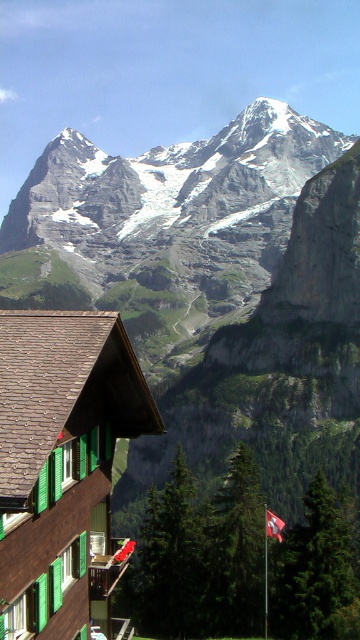
Between brown shingle chalet at lower left and red fabric flag at lower right, which one has less height?

With less height is red fabric flag at lower right.

Who is positioned more to the left, brown shingle chalet at lower left or red fabric flag at lower right?

brown shingle chalet at lower left is more to the left.

In the scene shown: Who is more forward, (x=51, y=360) or (x=279, y=536)?

Point (x=51, y=360) is more forward.

Find the location of a particular element. This screenshot has height=640, width=360. brown shingle chalet at lower left is located at coordinates (62, 467).

Is snowy granite mountain range at upper center positioned before red fabric flag at lower right?

No, it is behind red fabric flag at lower right.

Based on the photo, who is positioned more to the right, snowy granite mountain range at upper center or red fabric flag at lower right?

red fabric flag at lower right is more to the right.

Is point (270, 198) more distant than point (271, 518)?

Yes, point (270, 198) is farther from viewer.

The height and width of the screenshot is (640, 360). Find the location of `snowy granite mountain range at upper center`. snowy granite mountain range at upper center is located at coordinates (173, 196).

Who is positioned more to the right, brown shingle chalet at lower left or snowy granite mountain range at upper center?

Positioned to the right is snowy granite mountain range at upper center.

Does brown shingle chalet at lower left have a lesser width compared to snowy granite mountain range at upper center?

Correct, brown shingle chalet at lower left's width is less than snowy granite mountain range at upper center's.

I want to click on brown shingle chalet at lower left, so click(62, 467).